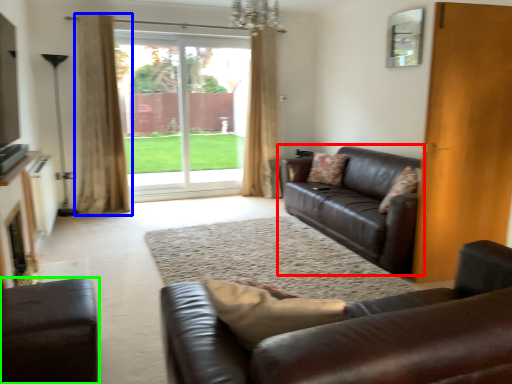
Question: Which is nearer to the studio couch (highlighted by a red box)? curtain (highlighted by a blue box) or studio couch (highlighted by a green box).

Choices:
 (A) curtain
 (B) studio couch

Answer: (B)